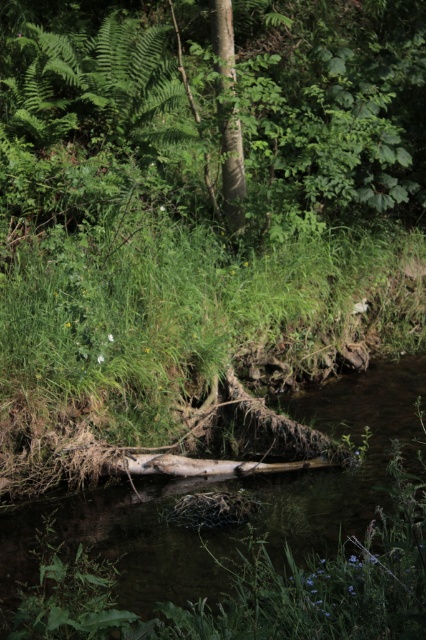
Which is behind, point (158, 547) or point (235, 208)?

Point (235, 208)

Is brown wood log at center to the left of smooth bark tree trunk at center from the viewer's perspective?

No, brown wood log at center is not to the left of smooth bark tree trunk at center.

This screenshot has height=640, width=426. Describe the element at coordinates (242, 541) in the screenshot. I see `brown wood log at center` at that location.

Identify the location of brown wood log at center. The height and width of the screenshot is (640, 426). (242, 541).